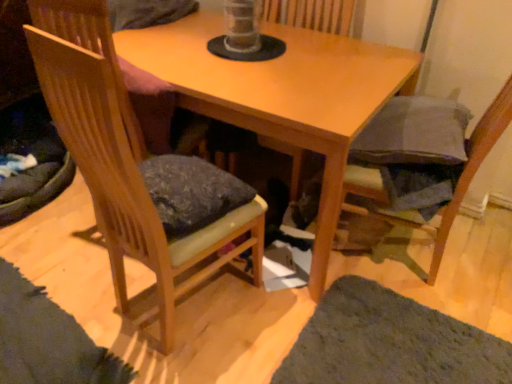
Question: Can you confirm if wooden swivel chair at center is bigger than green shaggy rug at lower right?

Choices:
 (A) no
 (B) yes

Answer: (B)

Question: From a real-world perspective, is wooden swivel chair at center under green shaggy rug at lower right?

Choices:
 (A) yes
 (B) no

Answer: (B)

Question: Is wooden swivel chair at center taller than green shaggy rug at lower right?

Choices:
 (A) no
 (B) yes

Answer: (B)

Question: Considering the relative positions of wooden swivel chair at center and green shaggy rug at lower right in the image provided, is wooden swivel chair at center behind green shaggy rug at lower right?

Choices:
 (A) no
 (B) yes

Answer: (B)

Question: Are wooden swivel chair at center and green shaggy rug at lower right located far from each other?

Choices:
 (A) yes
 (B) no

Answer: (A)

Question: Is wooden swivel chair at center to the right of green shaggy rug at lower right from the viewer's perspective?

Choices:
 (A) yes
 (B) no

Answer: (B)

Question: Does dark gray fabric cushion at lower right, acting as the 2th chair starting from the left, lie behind green shaggy rug at lower right?

Choices:
 (A) yes
 (B) no

Answer: (B)

Question: Can you confirm if dark gray fabric cushion at lower right, which is the 1th chair from right to left, is positioned to the left of green shaggy rug at lower right?

Choices:
 (A) no
 (B) yes

Answer: (A)

Question: Is dark gray fabric cushion at lower right, acting as the 2th chair starting from the left, not close to green shaggy rug at lower right?

Choices:
 (A) no
 (B) yes

Answer: (A)

Question: Is green shaggy rug at lower right located within dark gray fabric cushion at lower right, acting as the 2th chair starting from the left?

Choices:
 (A) yes
 (B) no

Answer: (B)

Question: Considering the relative sizes of dark gray fabric cushion at lower right, acting as the 2th chair starting from the left, and green shaggy rug at lower right in the image provided, is dark gray fabric cushion at lower right, acting as the 2th chair starting from the left, smaller than green shaggy rug at lower right?

Choices:
 (A) no
 (B) yes

Answer: (A)

Question: Is dark gray fabric cushion at lower right, acting as the 2th chair starting from the left, facing towards green shaggy rug at lower right?

Choices:
 (A) yes
 (B) no

Answer: (B)

Question: Considering the relative sizes of wooden chair at left, acting as the first chair starting from the left, and wooden table at center in the image provided, is wooden chair at left, acting as the first chair starting from the left, shorter than wooden table at center?

Choices:
 (A) yes
 (B) no

Answer: (B)